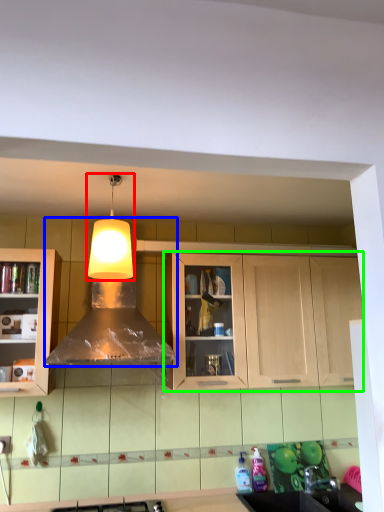
Question: Considering the real-world distances, which object is farthest from light fixture (highlighted by a red box)? hood (highlighted by a blue box) or cabinetry (highlighted by a green box)?

Choices:
 (A) hood
 (B) cabinetry

Answer: (B)